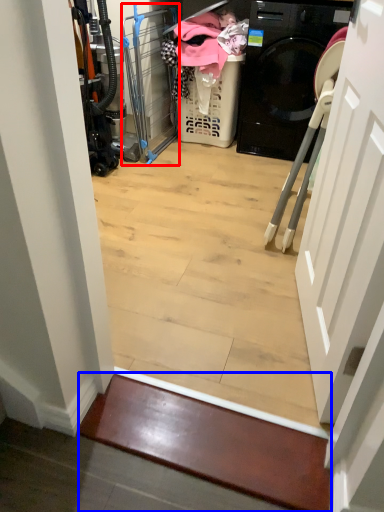
Question: Among these objects, which one is farthest to the camera, screen door (highlighted by a red box) or stairwell (highlighted by a blue box)?

Choices:
 (A) screen door
 (B) stairwell

Answer: (A)